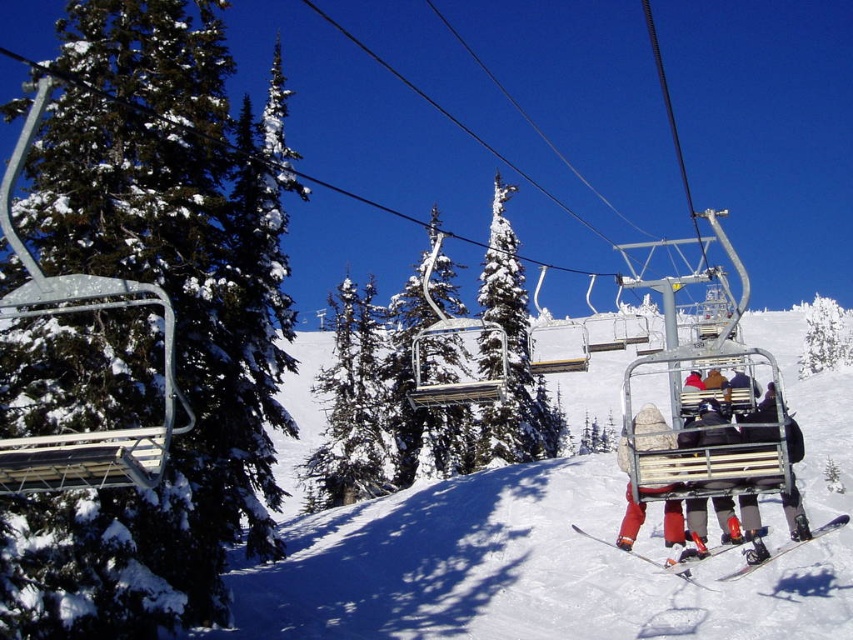
Which is behind, point (494, 204) or point (730, 442)?

The point (494, 204) is behind.

I want to click on snow-covered evergreen at center, so click(511, 349).

This screenshot has width=853, height=640. I want to click on snow-covered evergreen at center, so click(511, 349).

This screenshot has width=853, height=640. What are the coordinates of `snow-covered evergreen at center` in the screenshot? It's located at (511, 349).

Between white snow ski slope at center and metallic silver ski lift at center, which one appears on the left side from the viewer's perspective?

white snow ski slope at center

Who is positioned more to the right, white snow ski slope at center or metallic silver ski lift at center?

Positioned to the right is metallic silver ski lift at center.

The height and width of the screenshot is (640, 853). I want to click on white snow ski slope at center, so click(508, 563).

Who is positioned more to the left, green matte tree at left or matte black ski at lower right?

Positioned to the left is green matte tree at left.

Who is more distant from viewer, (222, 248) or (822, 529)?

The point (222, 248) is behind.

Is point (20, 369) more distant than point (791, 547)?

Yes, it is.

You are a GUI agent. You are given a task and a screenshot of the screen. Output one action in this format:
    pyautogui.click(x=<x>, y=<y>)
    Task: Click on the green matte tree at left
    Image resolution: width=853 pixels, height=640 pixels.
    Given the screenshot: What is the action you would take?
    pyautogui.click(x=173, y=308)